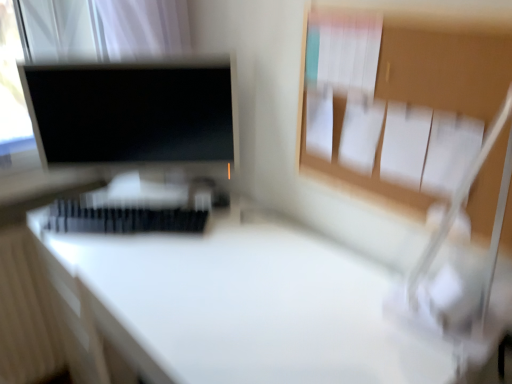
Question: Is white plastic keyboard at center bigger than matte black monitor at upper left?

Choices:
 (A) yes
 (B) no

Answer: (B)

Question: Are white plastic keyboard at center and matte black monitor at upper left beside each other?

Choices:
 (A) yes
 (B) no

Answer: (B)

Question: Is white plastic keyboard at center at the left side of matte black monitor at upper left?

Choices:
 (A) yes
 (B) no

Answer: (A)

Question: Is white plastic keyboard at center wider than matte black monitor at upper left?

Choices:
 (A) no
 (B) yes

Answer: (A)

Question: Is white plastic keyboard at center far from matte black monitor at upper left?

Choices:
 (A) yes
 (B) no

Answer: (B)

Question: Is matte black monitor at upper left at the back of white plastic keyboard at center?

Choices:
 (A) yes
 (B) no

Answer: (A)

Question: Is white glossy desk at center a part of matte black monitor at upper left?

Choices:
 (A) no
 (B) yes

Answer: (A)

Question: Is matte black monitor at upper left turned away from white glossy desk at center?

Choices:
 (A) yes
 (B) no

Answer: (B)

Question: Considering the relative sizes of matte black monitor at upper left and white glossy desk at center in the image provided, is matte black monitor at upper left bigger than white glossy desk at center?

Choices:
 (A) no
 (B) yes

Answer: (A)

Question: Is matte black monitor at upper left at the right side of white glossy desk at center?

Choices:
 (A) yes
 (B) no

Answer: (B)

Question: From a real-world perspective, is matte black monitor at upper left positioned over white glossy desk at center based on gravity?

Choices:
 (A) yes
 (B) no

Answer: (A)

Question: Can you confirm if matte black monitor at upper left is wider than white glossy desk at center?

Choices:
 (A) no
 (B) yes

Answer: (A)

Question: Can you confirm if white glossy desk at center is smaller than white plastic keyboard at center?

Choices:
 (A) no
 (B) yes

Answer: (A)